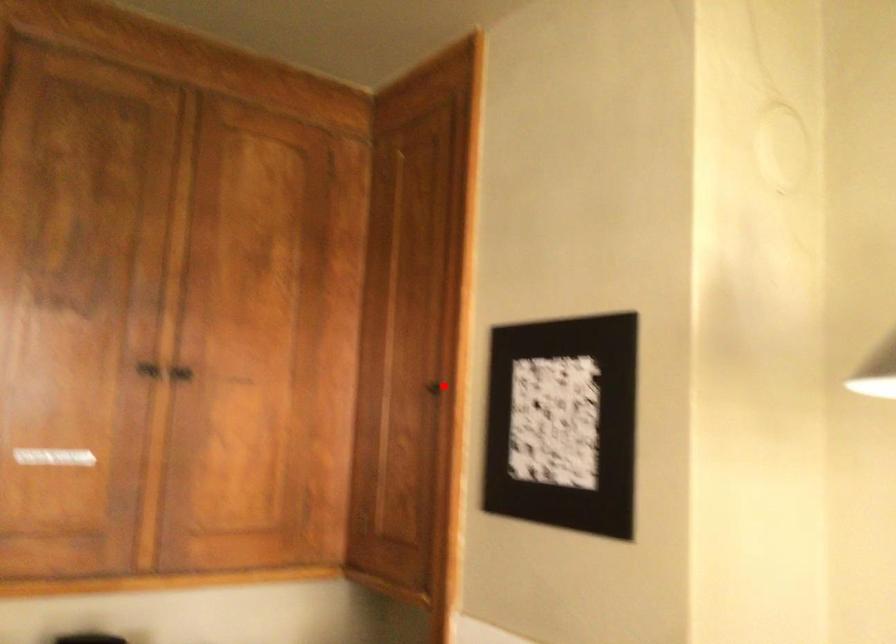
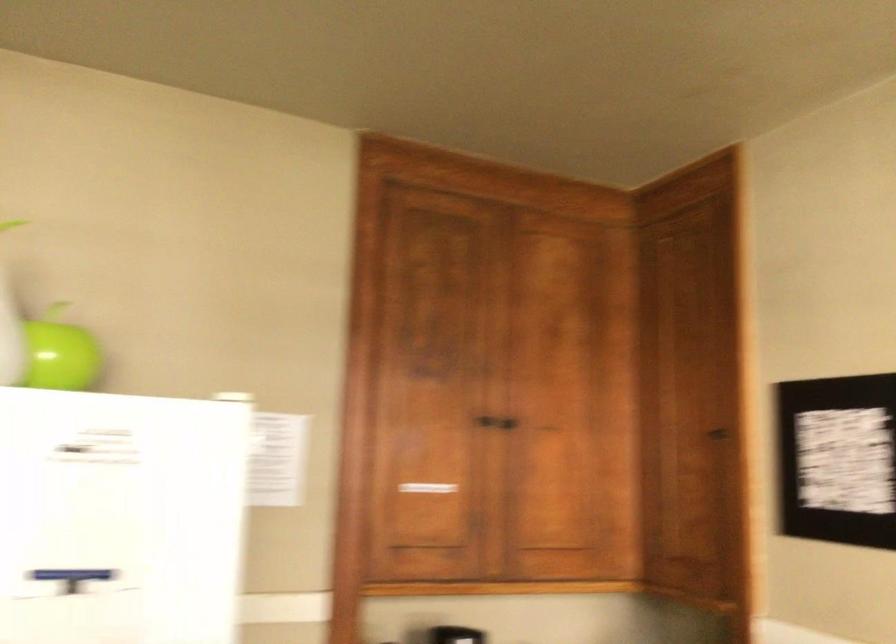
Question: A red point is marked in image1. In image2, is the corresponding 3D point closer to the camera or farther? Reply with the corresponding letter.

Choices:
 (A) The corresponding 3D point is closer.
 (B) The corresponding 3D point is farther.

Answer: (B)